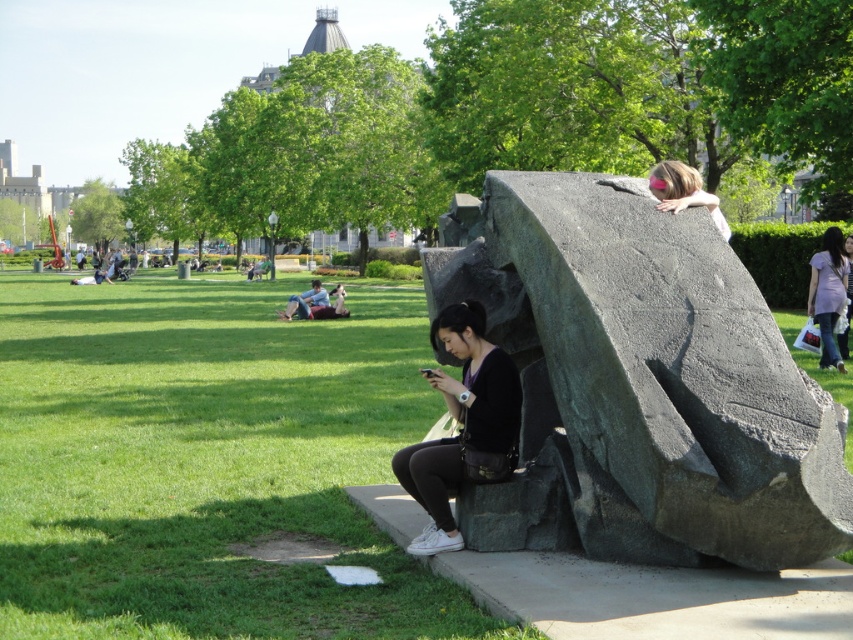
Which is behind, point (135, 474) or point (657, 172)?

The point (135, 474) is behind.

Who is shorter, green grass at lower left or pink matte rock at upper right?

pink matte rock at upper right

Between point (508, 632) and point (680, 193), which one is positioned behind?

The point (680, 193) is more distant.

At what (x,y) coordinates should I click in order to perform the action: click on green grass at lower left. Please return your answer as a coordinate pair (x, y). The width and height of the screenshot is (853, 640). Looking at the image, I should click on pyautogui.click(x=206, y=461).

Does dark gray stone sculpture at center lie in front of black matte shirt at center?

Yes.

Who is more forward, (712, 323) or (505, 410)?

Positioned in front is point (712, 323).

You are a GUI agent. You are given a task and a screenshot of the screen. Output one action in this format:
    pyautogui.click(x=<x>, y=<y>)
    Task: Click on the dark gray stone sculpture at center
    The image size is (853, 640).
    Given the screenshot: What is the action you would take?
    pyautogui.click(x=641, y=381)

Is the position of green grass at lower left more distant than that of matte black dress at right?

That is False.

Is point (422, 429) in front of point (840, 339)?

That is True.

What do you see at coordinates (206, 461) in the screenshot? I see `green grass at lower left` at bounding box center [206, 461].

I want to click on green grass at lower left, so click(x=206, y=461).